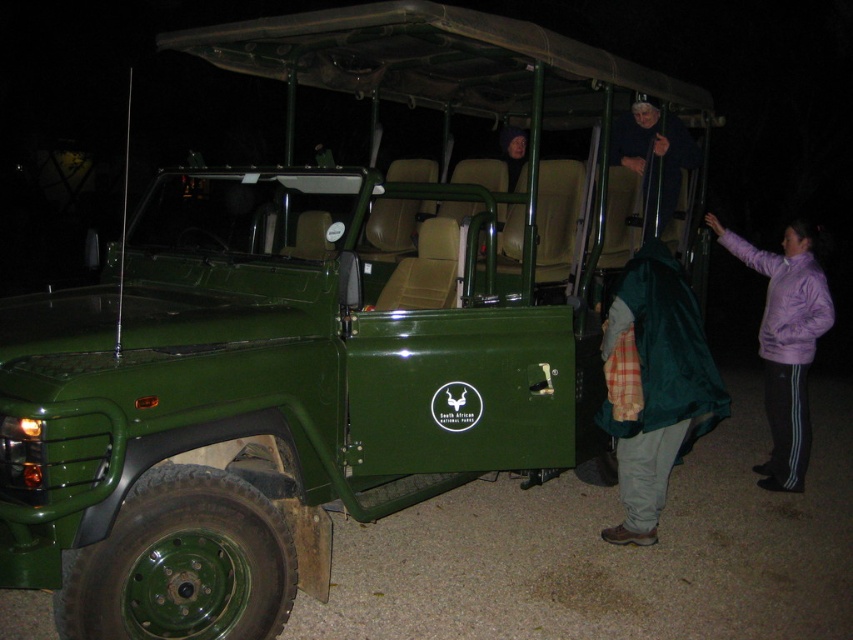
You are a photographer taking a picture of the scene. You notice the purple fleece jacket at right and the dark blue sweater at upper center. Which of these two items is closer to the bottom of the photo?

The purple fleece jacket at right is positioned under the dark blue sweater at upper center, so it is closer to the bottom of the photo.

You are standing at the point with coordinates (785, 342). Which object is located at this point?

The purple fleece jacket at right is located at the point with coordinates (785, 342).

You are a park ranger who needs to locate the purple fleece jacket at right. Based on the coordinates provided in the scene description, where exactly would you find it?

The purple fleece jacket at right is located at point coordinates (785,342).